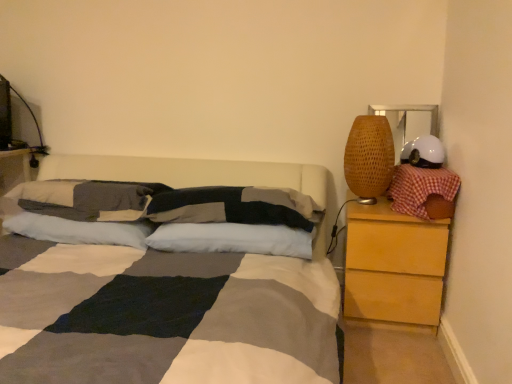
Question: Does white soft pillow at center, the 5th pillow viewed from the right, have a lesser width compared to textured cotton pillow at center, the second pillow viewed from the left?

Choices:
 (A) yes
 (B) no

Answer: (A)

Question: Does white soft pillow at center, the 5th pillow viewed from the right, have a greater height compared to textured cotton pillow at center, which is the fourth pillow from right to left?

Choices:
 (A) yes
 (B) no

Answer: (B)

Question: Is white soft pillow at center, the 5th pillow viewed from the right, facing away from textured cotton pillow at center, the second pillow viewed from the left?

Choices:
 (A) yes
 (B) no

Answer: (B)

Question: Is white soft pillow at center, arranged as the 1th pillow when viewed from the left, completely or partially outside of textured cotton pillow at center, which is the fourth pillow from right to left?

Choices:
 (A) no
 (B) yes

Answer: (B)

Question: Can you confirm if white soft pillow at center, the 5th pillow viewed from the right, is smaller than textured cotton pillow at center, the second pillow viewed from the left?

Choices:
 (A) no
 (B) yes

Answer: (B)

Question: From a real-world perspective, is white soft pillow at center, arranged as the 1th pillow when viewed from the left, physically below textured cotton pillow at center, the second pillow viewed from the left?

Choices:
 (A) yes
 (B) no

Answer: (A)

Question: Is there a large distance between red checkered pillow at right, the 1th pillow in the right-to-left sequence, and textured cotton pillow at center, the second pillow viewed from the left?

Choices:
 (A) no
 (B) yes

Answer: (B)

Question: Does red checkered pillow at right, the 1th pillow in the right-to-left sequence, contain textured cotton pillow at center, which is the fourth pillow from right to left?

Choices:
 (A) no
 (B) yes

Answer: (A)

Question: Is red checkered pillow at right, which appears as the 5th pillow when viewed from the left, smaller than textured cotton pillow at center, the second pillow viewed from the left?

Choices:
 (A) yes
 (B) no

Answer: (A)

Question: Considering the relative sizes of red checkered pillow at right, the 1th pillow in the right-to-left sequence, and textured cotton pillow at center, which is the fourth pillow from right to left, in the image provided, is red checkered pillow at right, the 1th pillow in the right-to-left sequence, shorter than textured cotton pillow at center, which is the fourth pillow from right to left,?

Choices:
 (A) no
 (B) yes

Answer: (A)

Question: Is red checkered pillow at right, which appears as the 5th pillow when viewed from the left, further to camera compared to textured cotton pillow at center, the second pillow viewed from the left?

Choices:
 (A) no
 (B) yes

Answer: (A)

Question: From a real-world perspective, does red checkered pillow at right, the 1th pillow in the right-to-left sequence, stand above textured cotton pillow at center, the second pillow viewed from the left?

Choices:
 (A) yes
 (B) no

Answer: (A)

Question: Are textured gray pillow at center, acting as the 3th pillow starting from the left, and white soft pillow at center, acting as the second pillow starting from the right, making contact?

Choices:
 (A) yes
 (B) no

Answer: (A)